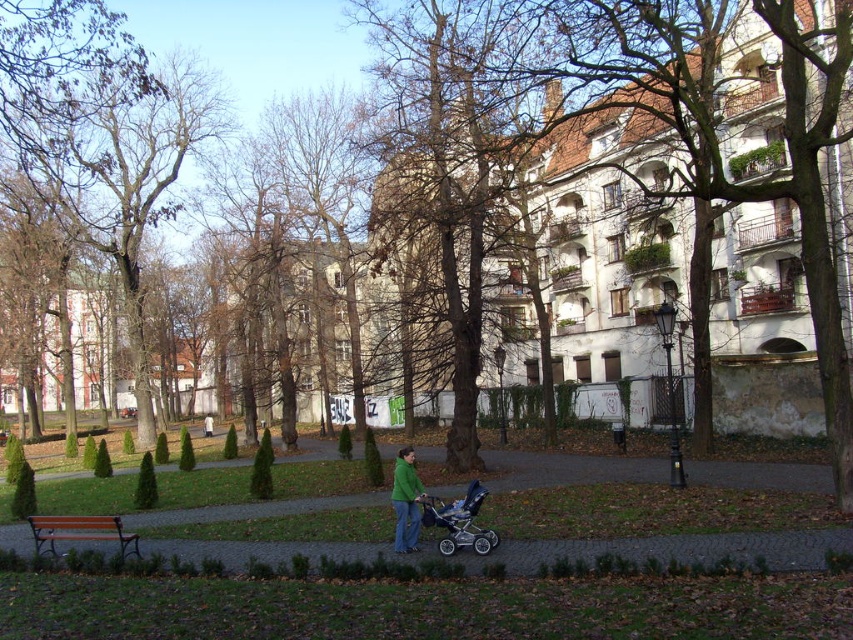
Does point (90, 518) lie in front of point (403, 486)?

No, it is not.

Who is lower down, orange painted wood bench at lower left or green matte jacket at center?

Positioned lower is green matte jacket at center.

Where is `orange painted wood bench at lower left`? The image size is (853, 640). orange painted wood bench at lower left is located at coordinates (80, 531).

At what (x,y) coordinates should I click in order to perform the action: click on orange painted wood bench at lower left. Please return your answer as a coordinate pair (x, y). Image resolution: width=853 pixels, height=640 pixels. Looking at the image, I should click on (80, 531).

Between point (463, 269) and point (36, 522), which one is positioned in front?

Positioned in front is point (36, 522).

Is point (445, 204) behind point (53, 529)?

Yes, it is behind point (53, 529).

Is point (439, 227) farther from camera compared to point (64, 516)?

Yes, it is behind point (64, 516).

Locate an element on the screen. brown rough bark tree at center is located at coordinates (463, 166).

Is brown paved path at lower center smaller than orange painted wood bench at lower left?

No, brown paved path at lower center is not smaller than orange painted wood bench at lower left.

How far apart are brown paved path at lower center and orange painted wood bench at lower left?

brown paved path at lower center is 5.31 feet from orange painted wood bench at lower left.

Who is more forward, (279, 548) or (135, 538)?

Point (135, 538)

You are a GUI agent. You are given a task and a screenshot of the screen. Output one action in this format:
    pyautogui.click(x=<x>, y=<y>)
    Task: Click on the brown paved path at lower center
    The image size is (853, 640).
    Given the screenshot: What is the action you would take?
    pyautogui.click(x=675, y=548)